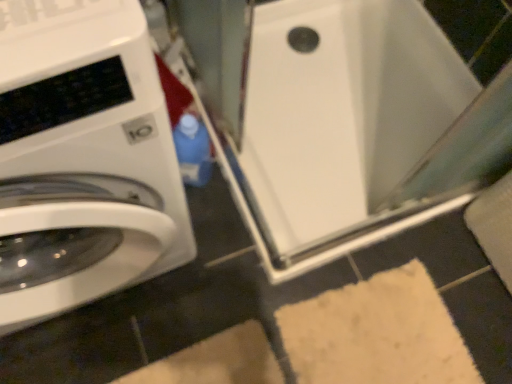
Identify the location of spots to the right of white glossy washing machine at left. The width and height of the screenshot is (512, 384). (248, 295).